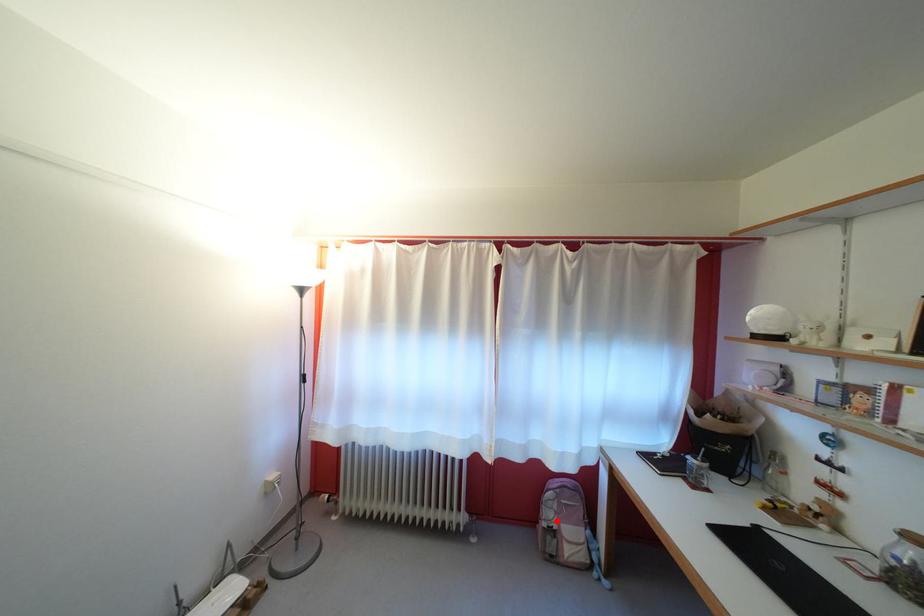
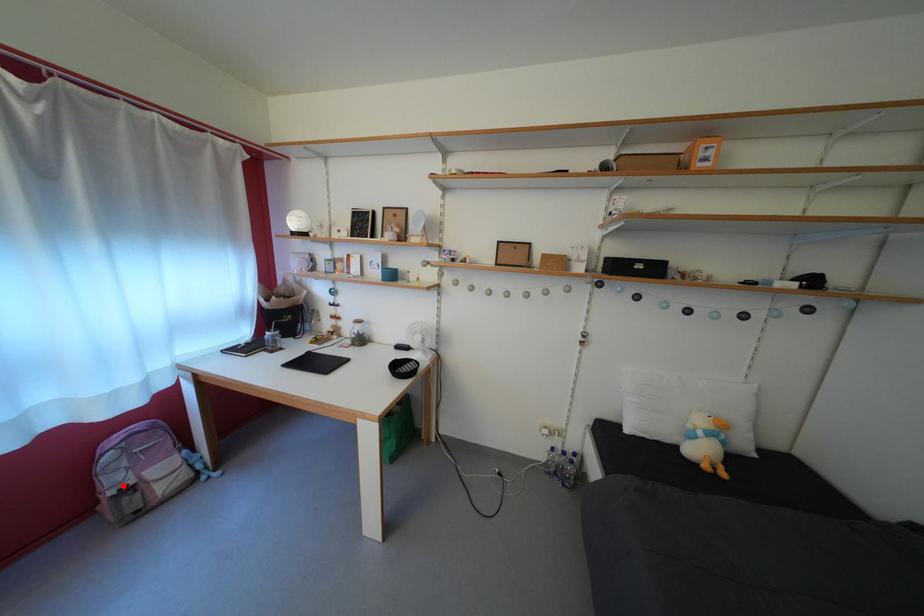
I am providing you with two images of the same scene from different viewpoints. A red point is marked on the first image and another point is marked on the second image. Is the red point in image1 aligned with the point shown in image2?

Yes